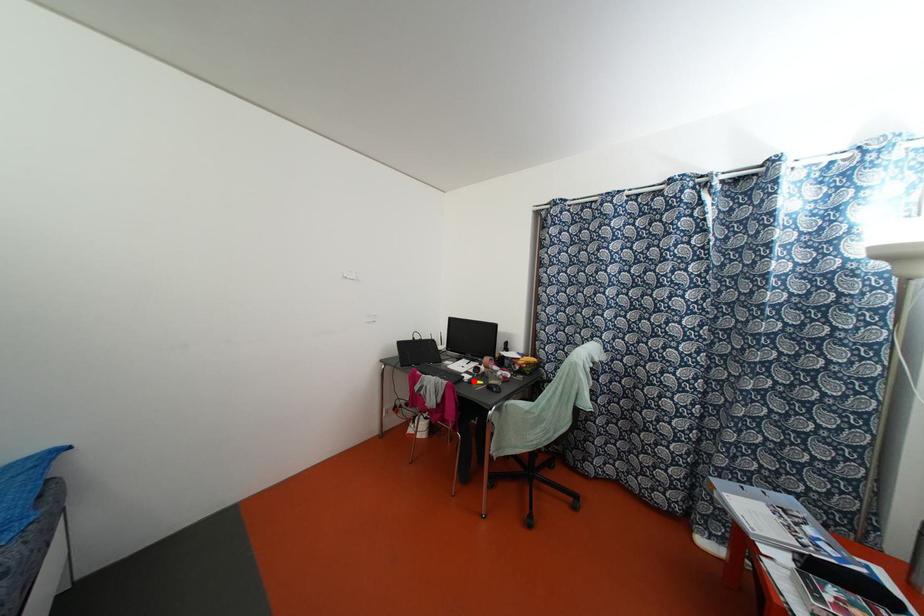
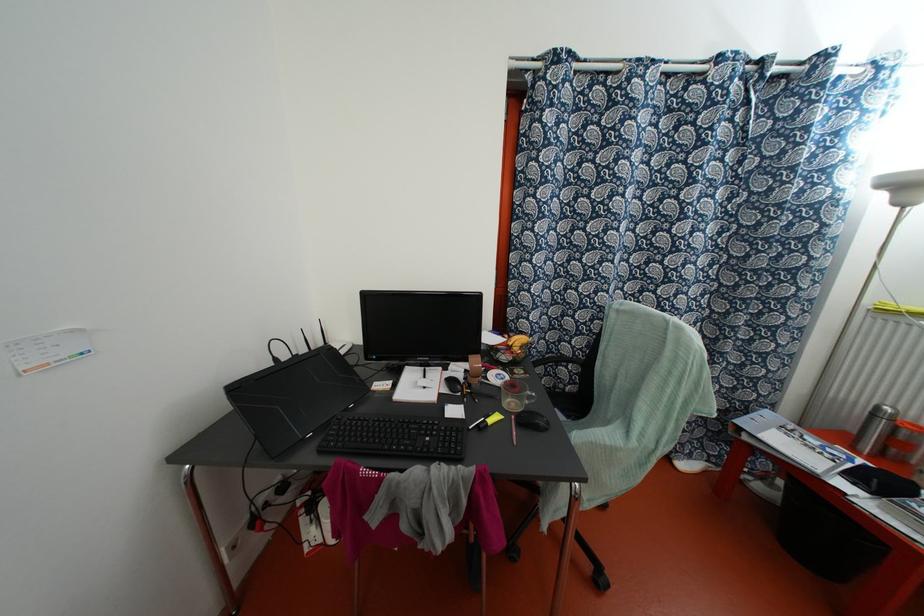
Locate, in the second image, the point that corresponds to the highlighted location in the first image.

(489, 421)